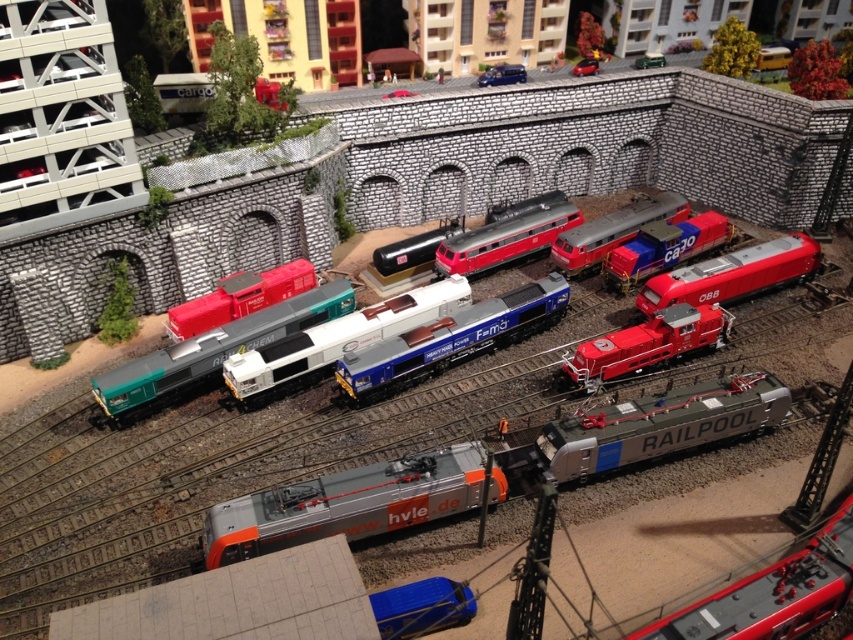
Question: Can you confirm if silver metallic locomotive at center is smaller than matte red train at center?

Choices:
 (A) yes
 (B) no

Answer: (A)

Question: Which is nearer to the matte red locomotive at center?

Choices:
 (A) silver metallic locomotive at center
 (B) blue metallic locomotive at center
 (C) matte red train at center

Answer: (C)

Question: Does silver metallic locomotive at center have a smaller size compared to matte red train at center?

Choices:
 (A) no
 (B) yes

Answer: (B)

Question: Does matte red train at center have a lesser width compared to matte red locomotive at center?

Choices:
 (A) no
 (B) yes

Answer: (A)

Question: Among these objects, which one is farthest from the camera?

Choices:
 (A) matte red train at center
 (B) matte red locomotive at center
 (C) silver metallic locomotive at center
 (D) blue metallic locomotive at center

Answer: (A)

Question: Which object appears farthest from the camera in this image?

Choices:
 (A) matte red train at center
 (B) matte red locomotive at center
 (C) silver metallic locomotive at center

Answer: (A)